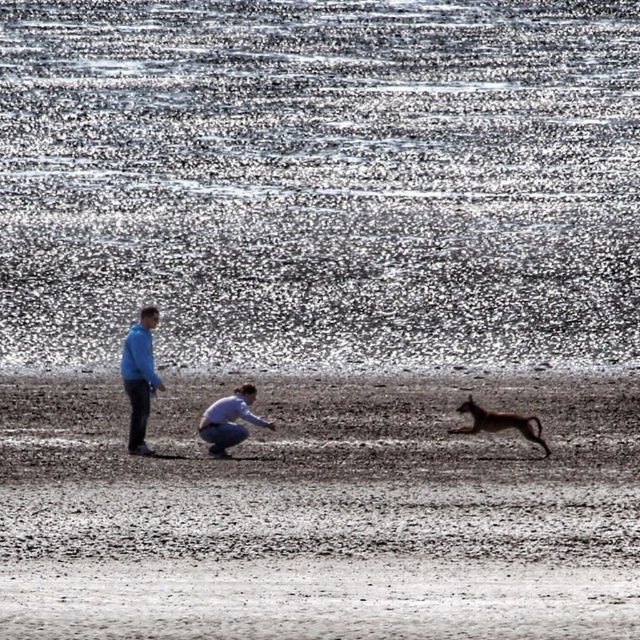
You are a photographer trying to capture a photo of the light blue fabric squat at center and the brown furry dog at right. Since you want both subjects to appear in proportion to their actual sizes in the image, which subject should you place closer to the camera?

The light blue fabric squat at center has a smaller width than the brown furry dog at right, so to maintain their actual size proportions in the photo, you should position the light blue fabric squat at center closer to the camera than the brown furry dog at right.

You are a photographer trying to capture a photo of the blue fabric man at left and the light blue fabric squat at center. Which object is positioned higher in the frame?

The blue fabric man at left is positioned higher in the frame than the light blue fabric squat at center.